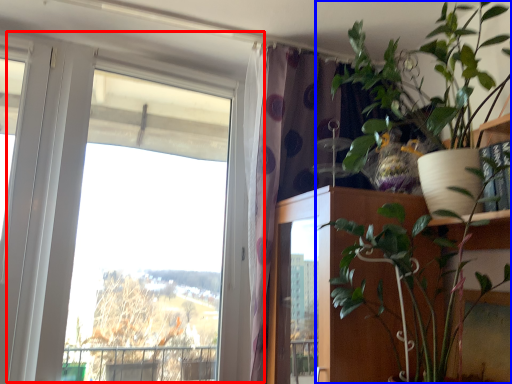
Question: Which object is further to the camera taking this photo, window (highlighted by a red box) or houseplant (highlighted by a blue box)?

Choices:
 (A) window
 (B) houseplant

Answer: (A)